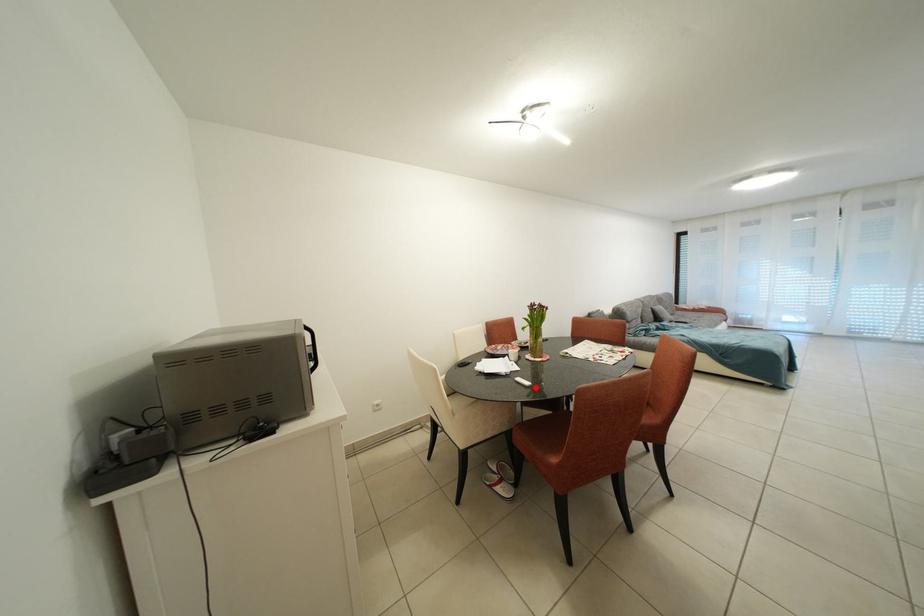
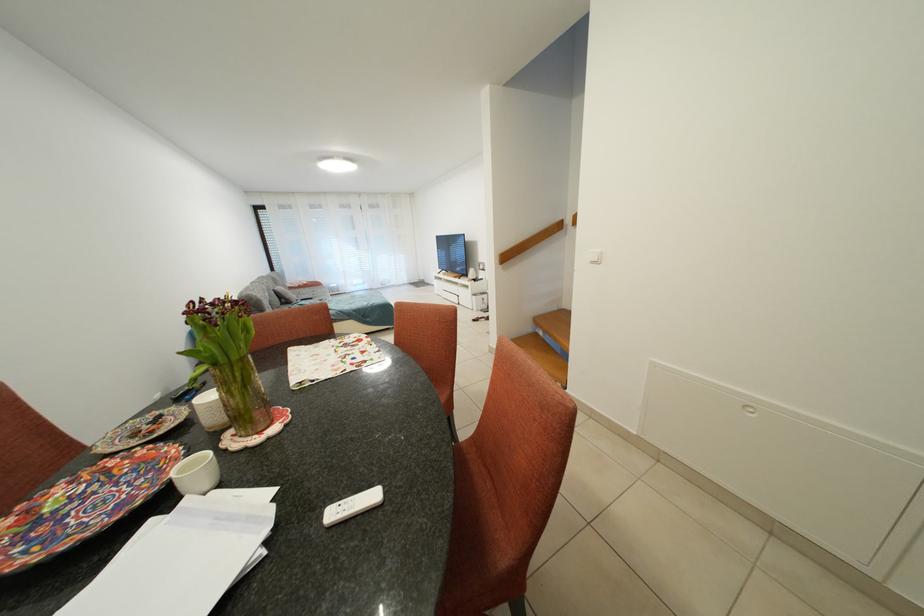
In the second image, find the point that corresponds to the highlighted location in the first image.

(382, 501)